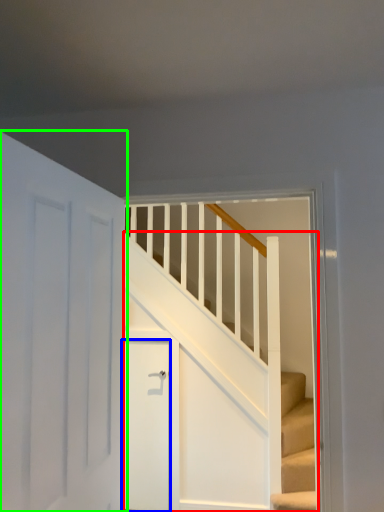
Question: Considering the real-world distances, which object is closest to stairs (highlighted by a red box)? door (highlighted by a blue box) or door (highlighted by a green box).

Choices:
 (A) door
 (B) door

Answer: (A)